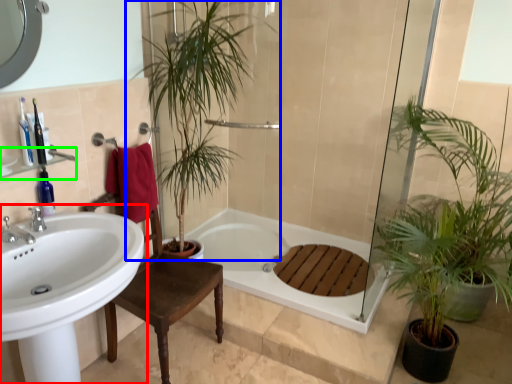
Question: Considering the real-world distances, which object is closest to sink (highlighted by a red box)? houseplant (highlighted by a blue box) or balustrade (highlighted by a green box).

Choices:
 (A) houseplant
 (B) balustrade

Answer: (B)